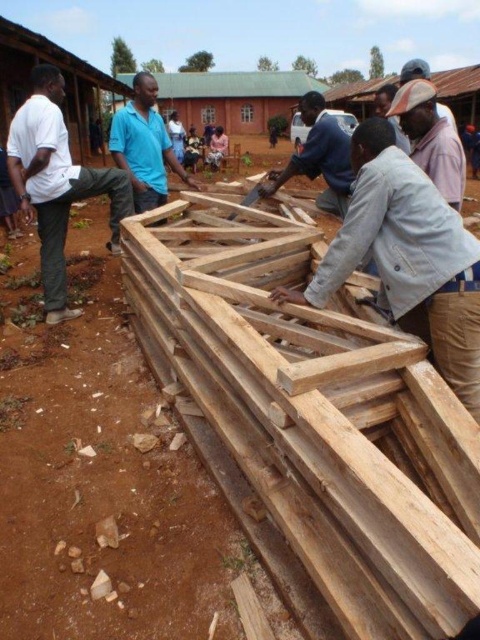
You are a construction worker who needs to place a 2.5 meter long steel beam on the available space. Based on the scene, which object between the light brown wood at center and the wooden frame at center can accommodate the beam?

The wooden frame at center is taller than the light brown wood at center, so the wooden frame at center can accommodate the 2.5 meter long steel beam.

You are a construction worker who just arrived at the site. You need to locate your white matte pants at left and wooden frame at center. Based on the scene, which object is positioned more to the left?

The white matte pants at left are positioned more to the left than the wooden frame at center because the description states that the white matte pants at left are to the left of the wooden frame at center.

You are standing at the origin point in the image. Where is the light brown wood at center located in terms of its 2D coordinates?

The light brown wood at center is located at coordinates point (408, 257).